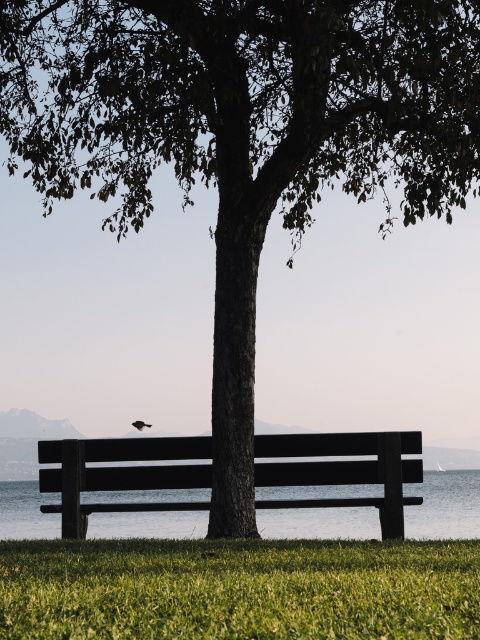
Question: Which object is positioned farthest from the green grassy at lower center?

Choices:
 (A) silhouette feathered bird at center
 (B) smooth dark wood bench at center

Answer: (A)

Question: Is smooth dark wood bench at center below silhouette feathered bird at center?

Choices:
 (A) yes
 (B) no

Answer: (A)

Question: Is the position of green grassy at lower center more distant than that of smooth dark wood bench at center?

Choices:
 (A) yes
 (B) no

Answer: (B)

Question: Which is nearer to the silhouette feathered bird at center?

Choices:
 (A) smooth dark wood bench at center
 (B) green grassy at lower center

Answer: (A)

Question: Which point is farther from the camera taking this photo?

Choices:
 (A) (195, 611)
 (B) (135, 422)

Answer: (B)

Question: Observing the image, what is the correct spatial positioning of smooth dark wood bench at center in reference to silhouette feathered bird at center?

Choices:
 (A) below
 (B) above

Answer: (A)